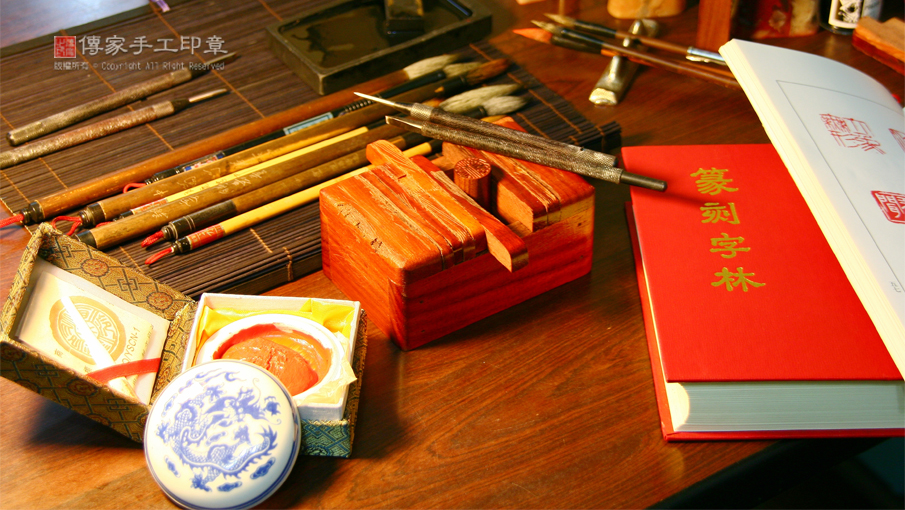
Where is `brown bamboo placemat`? brown bamboo placemat is located at coordinates (256, 92).